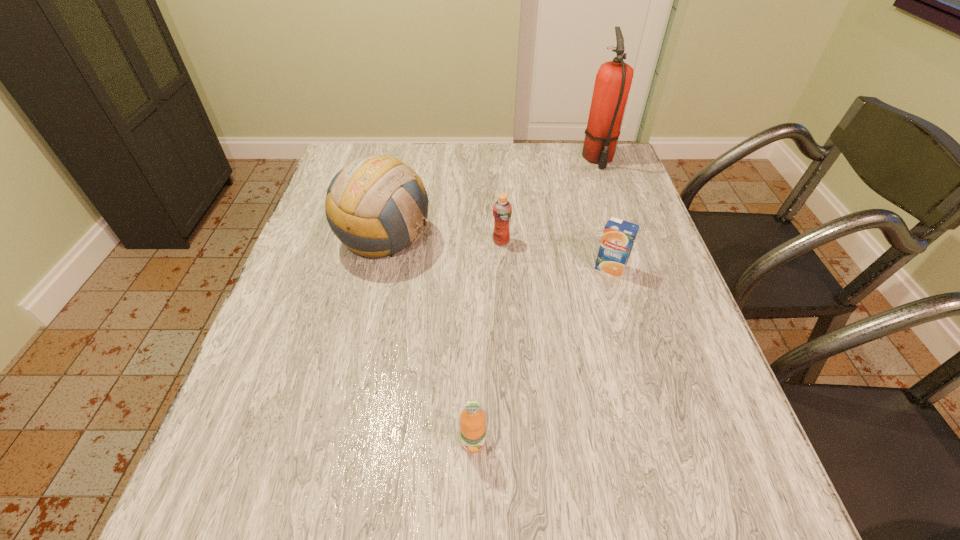
Locate an element on the screen. fire extinguisher is located at coordinates (613, 81).

This screenshot has width=960, height=540. Find the location of `the tallest object`. the tallest object is located at coordinates (613, 81).

Find the location of `the leftmost object`. the leftmost object is located at coordinates (376, 205).

The image size is (960, 540). Find the location of `volleyball`. volleyball is located at coordinates (376, 205).

The image size is (960, 540). Identify the location of the third object from right to left. (502, 209).

You are a GUI agent. You are given a task and a screenshot of the screen. Output one action in this format:
    pyautogui.click(x=<x>, y=<y>)
    Task: Click on the second orange juice from right to left
    This screenshot has height=540, width=960.
    Given the screenshot: What is the action you would take?
    pyautogui.click(x=502, y=209)

Identify the location of the rightmost orange juice. This screenshot has height=540, width=960. click(x=618, y=238).

The height and width of the screenshot is (540, 960). In order to click on the nearest object in this screenshot , I will do `click(472, 418)`.

Identify the location of the second object from left to right. (472, 418).

Image resolution: width=960 pixels, height=540 pixels. I want to click on vacant space located on the nozzle of the fire extinguisher, so click(620, 222).